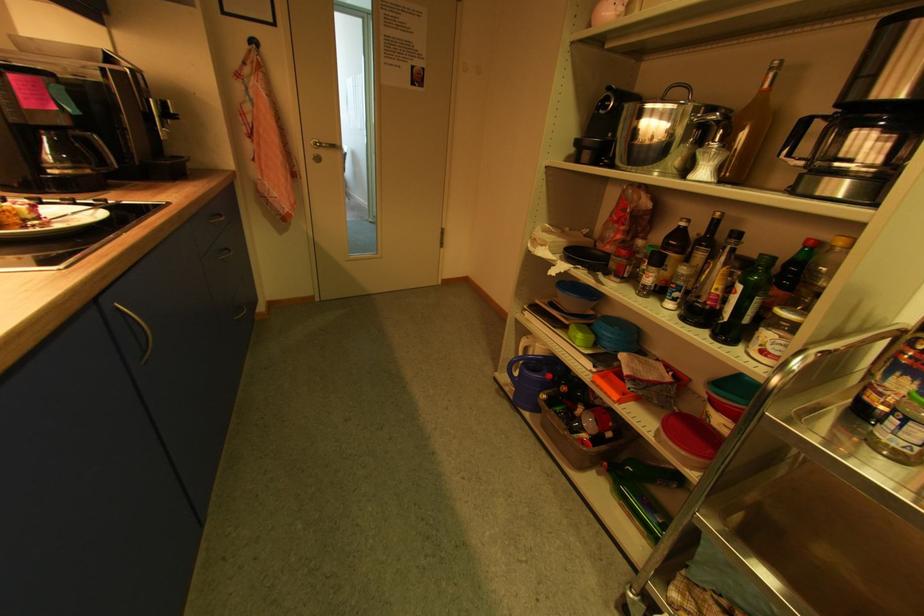
Describe the element at coordinates (743, 174) in the screenshot. I see `a coffee carafe handle` at that location.